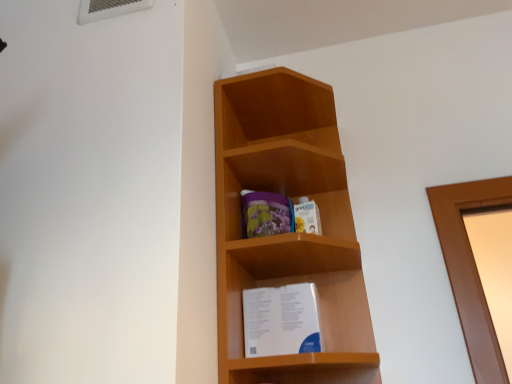
Question: From a real-world perspective, is white paper at center positioned above or below light brown wood at center?

Choices:
 (A) below
 (B) above

Answer: (A)

Question: Considering their positions, is white paper at center located in front of or behind light brown wood at center?

Choices:
 (A) behind
 (B) front

Answer: (A)

Question: From the image's perspective, relative to light brown wood at center, is white paper at center above or below?

Choices:
 (A) below
 (B) above

Answer: (A)

Question: Is light brown wood at center bigger or smaller than white paper at center?

Choices:
 (A) small
 (B) big

Answer: (B)

Question: Is light brown wood at center spatially inside white paper at center, or outside of it?

Choices:
 (A) inside
 (B) outside

Answer: (B)

Question: Is light brown wood at center in front of or behind white paper at center in the image?

Choices:
 (A) behind
 (B) front

Answer: (B)

Question: Is light brown wood at center taller or shorter than white paper at center?

Choices:
 (A) short
 (B) tall

Answer: (B)